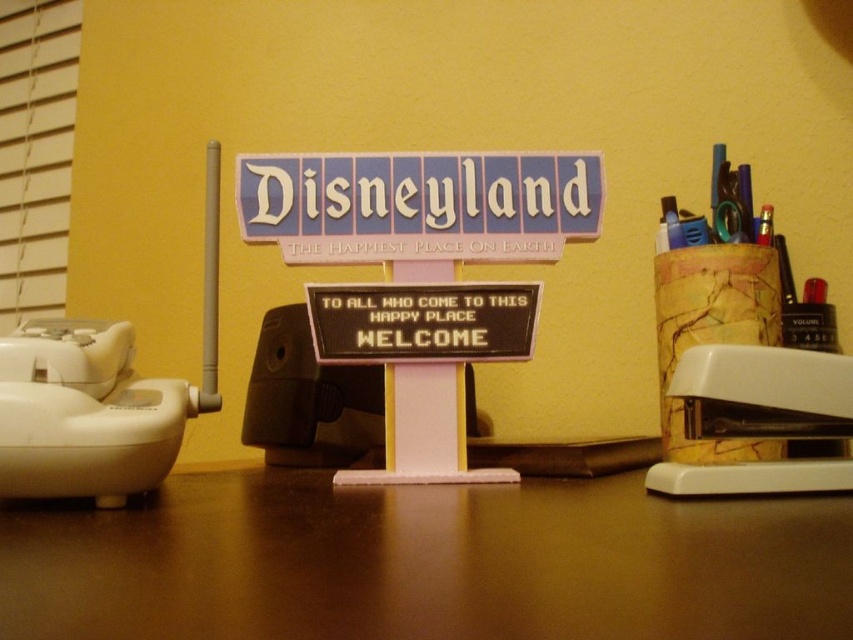
Does white plastic stapler at right appear on the left side of black plastic sign at center?

Incorrect, white plastic stapler at right is not on the left side of black plastic sign at center.

Is white plastic stapler at right positioned at the back of black plastic sign at center?

That is False.

The height and width of the screenshot is (640, 853). What do you see at coordinates (763, 392) in the screenshot? I see `white plastic stapler at right` at bounding box center [763, 392].

The height and width of the screenshot is (640, 853). What are the coordinates of `white plastic stapler at right` in the screenshot? It's located at (763, 392).

Is brown matte table at center below white plastic stapler at lower left?

Indeed, brown matte table at center is positioned under white plastic stapler at lower left.

Who is more distant from viewer, (x=372, y=556) or (x=73, y=440)?

The point (x=73, y=440) is more distant.

Is point (724, 513) more distant than point (103, 387)?

No.

Locate an element on the screen. brown matte table at center is located at coordinates (425, 563).

Is matte plastic disneyland sign at center to the right of white plastic stapler at lower left from the viewer's perspective?

Yes, matte plastic disneyland sign at center is to the right of white plastic stapler at lower left.

Does matte plastic disneyland sign at center lie behind white plastic stapler at lower left?

That is True.

At what (x,y) coordinates should I click in order to perform the action: click on matte plastic disneyland sign at center. Please return your answer as a coordinate pair (x, y). Looking at the image, I should click on (419, 205).

The width and height of the screenshot is (853, 640). What are the coordinates of `matte plastic disneyland sign at center` in the screenshot? It's located at (419, 205).